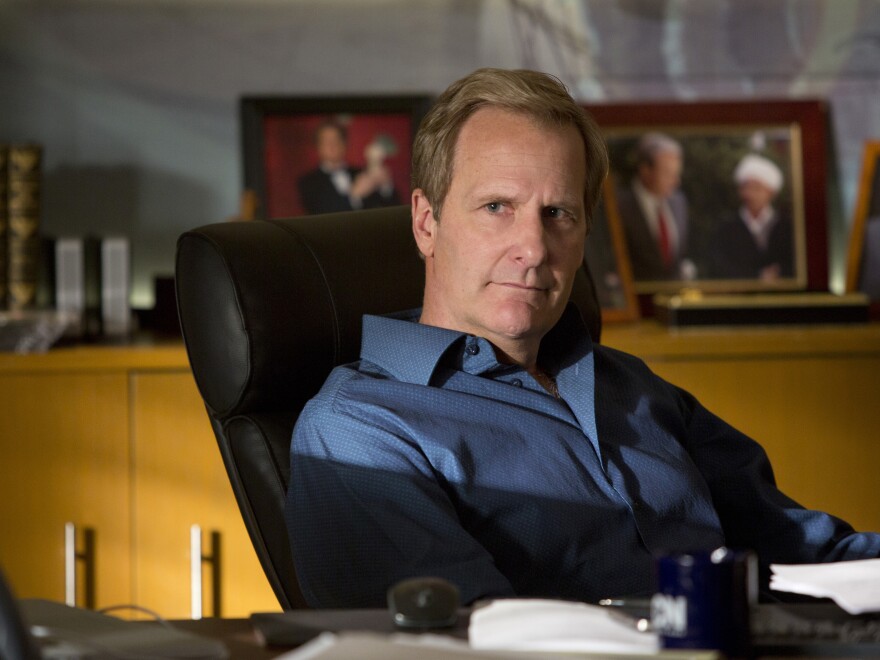
You are a GUI agent. You are given a task and a screenshot of the screen. Output one action in this format:
    pyautogui.click(x=<x>, y=<y>)
    Task: Click on the phone
    
    Given the screenshot: What is the action you would take?
    pyautogui.click(x=538, y=622)